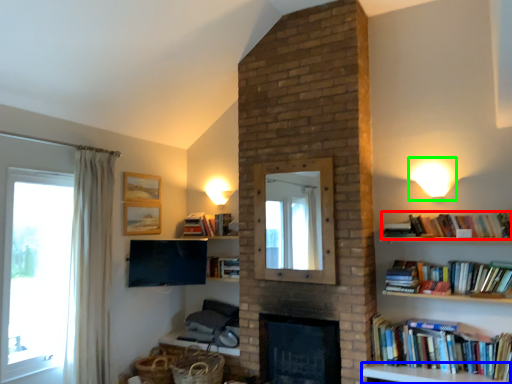
Question: Estimate the real-world distances between objects in this image. Which object is closer to book (highlighted by a red box), furniture (highlighted by a blue box) or light fixture (highlighted by a green box)?

Choices:
 (A) furniture
 (B) light fixture

Answer: (B)